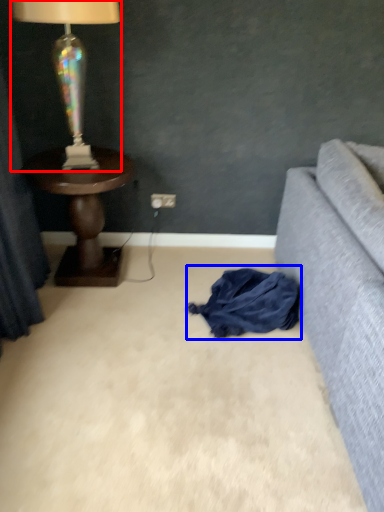
Question: Among these objects, which one is farthest to the camera, lamp (highlighted by a red box) or clothing (highlighted by a blue box)?

Choices:
 (A) lamp
 (B) clothing

Answer: (B)